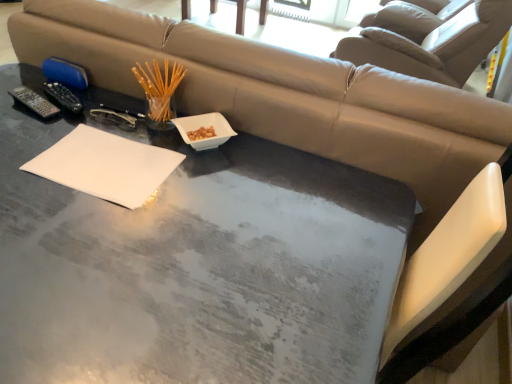
Question: From a real-world perspective, relative to white matte notepad at center, is beige leather swivel chair at upper center vertically above or below?

Choices:
 (A) above
 (B) below

Answer: (B)

Question: Looking at the image, does beige leather swivel chair at upper center seem bigger or smaller compared to white matte notepad at center?

Choices:
 (A) small
 (B) big

Answer: (B)

Question: Which is nearer to the beige leather swivel chair at upper center?

Choices:
 (A) wooden chair at upper center
 (B) white matte notepad at center
 (C) black plastic remote at left
 (D) translucent glass chopsticks at upper left
 (E) white ceramic bowl at center

Answer: (A)

Question: Estimate the real-world distances between objects in this image. Which object is farther from the white matte notepad at center?

Choices:
 (A) beige leather swivel chair at upper center
 (B) translucent glass chopsticks at upper left
 (C) white ceramic bowl at center
 (D) wooden chair at upper center
 (E) black plastic remote at left

Answer: (D)